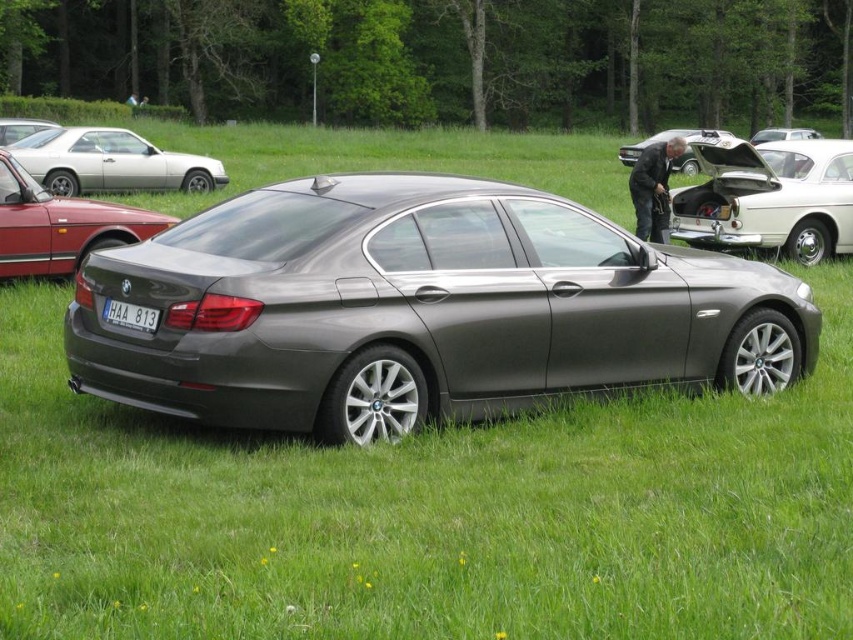
You are a photographer trying to capture the metallic gray car at center and the matte black car at upper left in a single shot. Based on their positions, can you tell which car is closer to the bottom edge of the photo?

The metallic gray car at center is located below matte black car at upper left, so the metallic gray car at center is closer to the bottom edge of the photo.